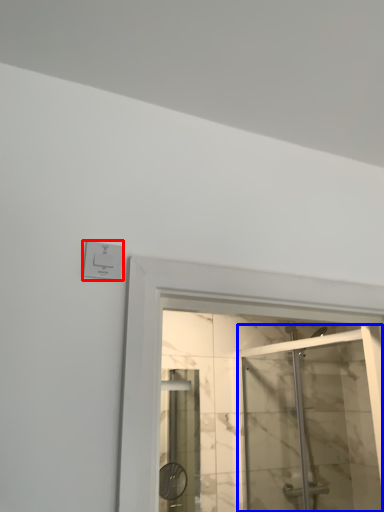
Question: Among these objects, which one is farthest to the camera, electric outlet (highlighted by a red box) or screen door (highlighted by a blue box)?

Choices:
 (A) electric outlet
 (B) screen door

Answer: (B)